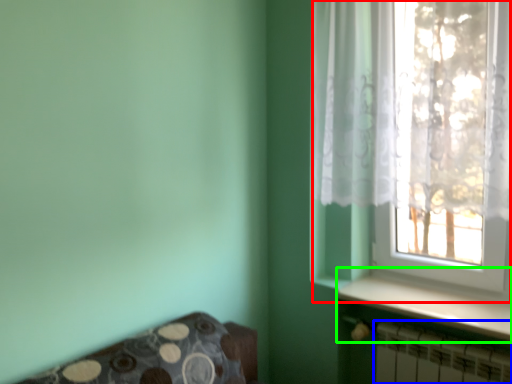
Question: Based on their relative distances, which object is farther from window (highlighted by a red box)? Choose from radiator (highlighted by a blue box) and window sill (highlighted by a green box).

Choices:
 (A) radiator
 (B) window sill

Answer: (A)